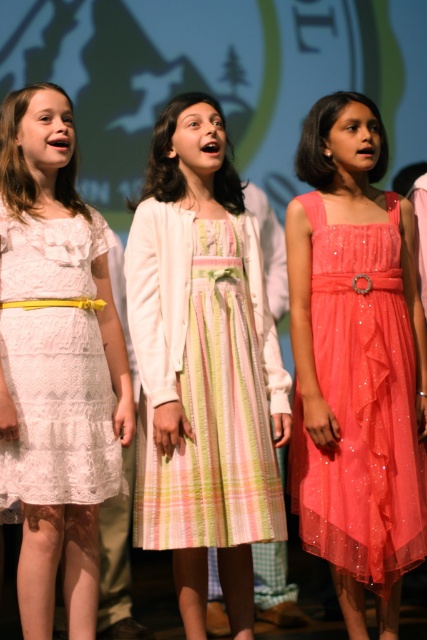
Question: Which point appears farthest from the camera in this image?

Choices:
 (A) (78, 442)
 (B) (157, 241)

Answer: (B)

Question: Is shiny coral tulle dress at center closer to camera compared to white lace dress at left?

Choices:
 (A) no
 (B) yes

Answer: (A)

Question: Based on their relative distances, which object is nearer to the white lace dress at left?

Choices:
 (A) shiny coral tulle dress at center
 (B) pastel plaid dress at center

Answer: (B)

Question: Based on their relative distances, which object is nearer to the pastel plaid dress at center?

Choices:
 (A) white lace dress at left
 (B) shiny coral tulle dress at center

Answer: (A)

Question: Is pastel plaid dress at center further to camera compared to shiny coral tulle dress at center?

Choices:
 (A) no
 (B) yes

Answer: (A)

Question: Is shiny coral tulle dress at center to the left of white lace dress at left from the viewer's perspective?

Choices:
 (A) no
 (B) yes

Answer: (A)